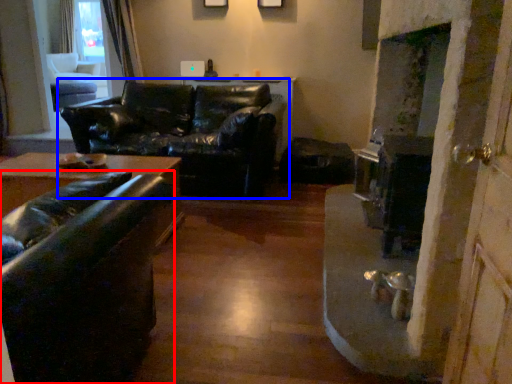
Question: Which object appears closest to the camera in this image, studio couch (highlighted by a red box) or studio couch (highlighted by a blue box)?

Choices:
 (A) studio couch
 (B) studio couch

Answer: (A)